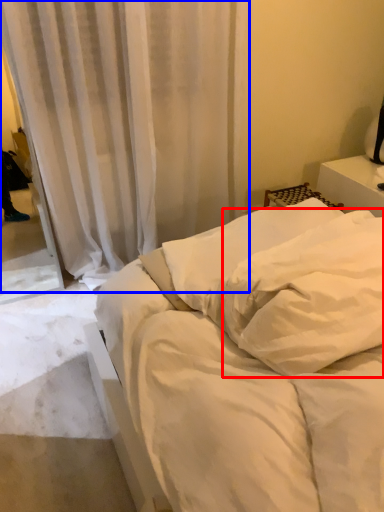
Question: Which object is closer to the camera taking this photo, pillow (highlighted by a red box) or curtain (highlighted by a blue box)?

Choices:
 (A) pillow
 (B) curtain

Answer: (A)